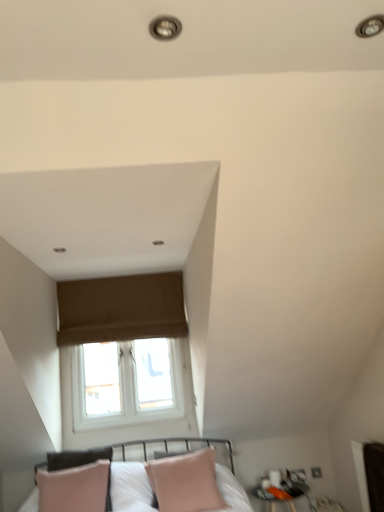
I want to click on matte black side table at lower right, so click(277, 495).

Based on the photo, measure the distance between matte black side table at lower right and camera.

They are 10.64 feet apart.

Locate an element on the screen. This screenshot has height=512, width=384. pink leather pillow at lower center is located at coordinates (186, 482).

Describe the element at coordinates (121, 308) in the screenshot. I see `brown fabric window at upper center` at that location.

Locate an element on the screen. The height and width of the screenshot is (512, 384). matte black side table at lower right is located at coordinates (277, 495).

Is point (167, 470) in front of point (261, 493)?

Yes, it is in front of point (261, 493).

Looking at this image, can you confirm if pink leather pillow at lower center is taller than matte black side table at lower right?

Indeed, pink leather pillow at lower center has a greater height compared to matte black side table at lower right.

From the picture: Which of these two, pink leather pillow at lower center or matte black side table at lower right, is smaller?

Smaller between the two is matte black side table at lower right.

Is pink leather pillow at lower center far away from matte black side table at lower right?

pink leather pillow at lower center is near matte black side table at lower right, not far away.

Is the surface of matte black side table at lower right in direct contact with pink leather pillow at lower center?

No, matte black side table at lower right is not with pink leather pillow at lower center.

Can you confirm if matte black side table at lower right is wider than pink leather pillow at lower center?

Yes, matte black side table at lower right is wider than pink leather pillow at lower center.

From a real-world perspective, is matte black side table at lower right beneath pink leather pillow at lower center?

Yes, from a real-world perspective, matte black side table at lower right is below pink leather pillow at lower center.

In the scene shown: Is matte black side table at lower right closer to the viewer compared to pink leather pillow at lower center?

That is False.

Locate an element on the screen. The height and width of the screenshot is (512, 384). window on the left side of pink leather pillow at lower center is located at coordinates (121, 308).

Is point (193, 469) closer to viewer compared to point (109, 333)?

Yes, it is in front of point (109, 333).

Consider the image. Is pink leather pillow at lower center positioned beyond the bounds of brown fabric window at upper center?

Yes, pink leather pillow at lower center is located beyond the bounds of brown fabric window at upper center.

Can you confirm if brown fabric window at upper center is smaller than pink leather pillow at lower center?

Correct, brown fabric window at upper center occupies less space than pink leather pillow at lower center.

Does brown fabric window at upper center appear on the left side of pink leather pillow at lower center?

Indeed, brown fabric window at upper center is positioned on the left side of pink leather pillow at lower center.

How different are the orientations of brown fabric window at upper center and pink leather pillow at lower center in degrees?

The facing directions of brown fabric window at upper center and pink leather pillow at lower center are 6.22 degrees apart.

Based on the photo, in terms of width, does brown fabric window at upper center look wider or thinner when compared to pink leather pillow at lower center?

brown fabric window at upper center is thinner than pink leather pillow at lower center.

Measure the distance from matte black side table at lower right to brown fabric window at upper center.

matte black side table at lower right and brown fabric window at upper center are 1.84 meters apart.

Is brown fabric window at upper center surrounded by matte black side table at lower right?

No, matte black side table at lower right does not contain brown fabric window at upper center.

Between matte black side table at lower right and brown fabric window at upper center, which one has smaller size?

With smaller size is matte black side table at lower right.

From the image's perspective, is matte black side table at lower right located beneath brown fabric window at upper center?

Indeed, from the image's perspective, matte black side table at lower right is shown beneath brown fabric window at upper center.

Is brown fabric window at upper center oriented towards matte black side table at lower right?

No, brown fabric window at upper center does not turn towards matte black side table at lower right.

Based on the photo, from a real-world perspective, is brown fabric window at upper center physically located above or below matte black side table at lower right?

brown fabric window at upper center is above matte black side table at lower right.

What's the angular difference between brown fabric window at upper center and matte black side table at lower right's facing directions?

The facing directions of brown fabric window at upper center and matte black side table at lower right are 0.741 degrees apart.

From the image's perspective, is brown fabric window at upper center located above or below matte black side table at lower right?

From the image's perspective, brown fabric window at upper center appears above matte black side table at lower right.

Locate an element on the screen. side table that appears below the pink leather pillow at lower center (from the image's perspective) is located at coordinates (277, 495).

Where is `pillow that is in front of the matte black side table at lower right`? pillow that is in front of the matte black side table at lower right is located at coordinates (186, 482).

Consider the image. Looking at the image, which one is located closer to matte black side table at lower right, brown fabric window at upper center or pink leather pillow at lower center?

Among the two, pink leather pillow at lower center is located nearer to matte black side table at lower right.

Looking at the image, which one is located further to brown fabric window at upper center, pink leather pillow at lower center or matte black side table at lower right?

matte black side table at lower right lies further to brown fabric window at upper center than the other object.

Looking at the image, which one is located further to matte black side table at lower right, pink leather pillow at lower center or brown fabric window at upper center?

brown fabric window at upper center is further to matte black side table at lower right.

From the image, which object appears to be farther from brown fabric window at upper center, matte black side table at lower right or pink leather pillow at lower center?

Among the two, matte black side table at lower right is located further to brown fabric window at upper center.

Which object lies further to the anchor point pink leather pillow at lower center, matte black side table at lower right or brown fabric window at upper center?

Among the two, brown fabric window at upper center is located further to pink leather pillow at lower center.

In the scene shown: From the image, which object appears to be farther from pink leather pillow at lower center, brown fabric window at upper center or matte black side table at lower right?

The object further to pink leather pillow at lower center is brown fabric window at upper center.

I want to click on pillow between brown fabric window at upper center and matte black side table at lower right from left to right, so click(186, 482).